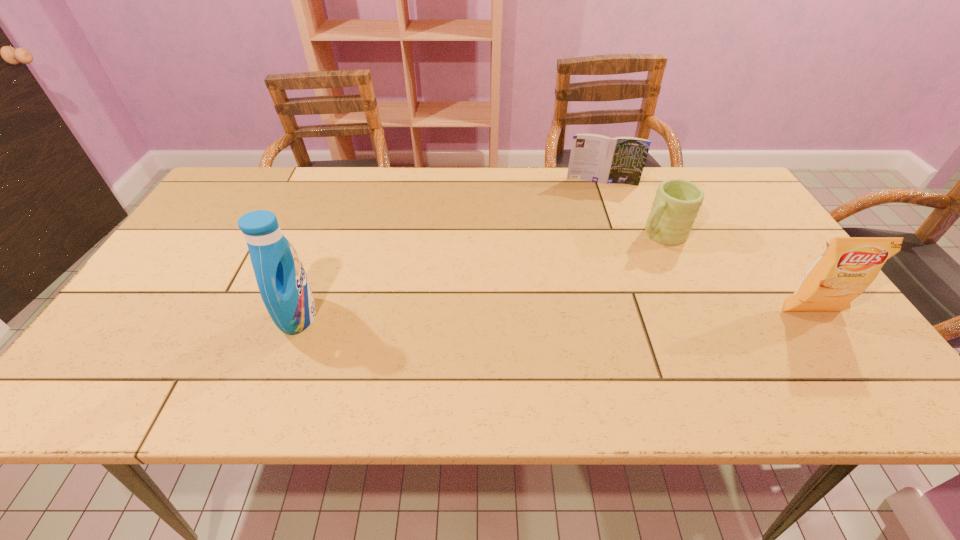
The image size is (960, 540). I want to click on vacant space located 0.200m on the side of the second farthest object with the handle, so click(589, 273).

This screenshot has width=960, height=540. Identify the location of vacant space located 0.100m on the front cover of the farthest object. (597, 205).

At what (x,y) coordinates should I click in order to perform the action: click on vacant space located 0.240m on the front cover of the farthest object. Please return your answer as a coordinate pair (x, y). Looking at the image, I should click on (598, 234).

Image resolution: width=960 pixels, height=540 pixels. In order to click on vacant space located on the front cover of the farthest object in this screenshot , I will do `click(597, 219)`.

Where is `object that is at the far edge`? The height and width of the screenshot is (540, 960). object that is at the far edge is located at coordinates (596, 158).

Where is `object located in the near edge section of the desktop`? The image size is (960, 540). object located in the near edge section of the desktop is located at coordinates (282, 281).

The width and height of the screenshot is (960, 540). Find the location of `object that is at the right edge`. object that is at the right edge is located at coordinates (849, 265).

The image size is (960, 540). I want to click on vacant space at the far edge, so click(x=660, y=183).

The width and height of the screenshot is (960, 540). I want to click on free location at the near edge, so click(754, 355).

The width and height of the screenshot is (960, 540). I want to click on vacant space at the left edge of the desktop, so click(x=206, y=223).